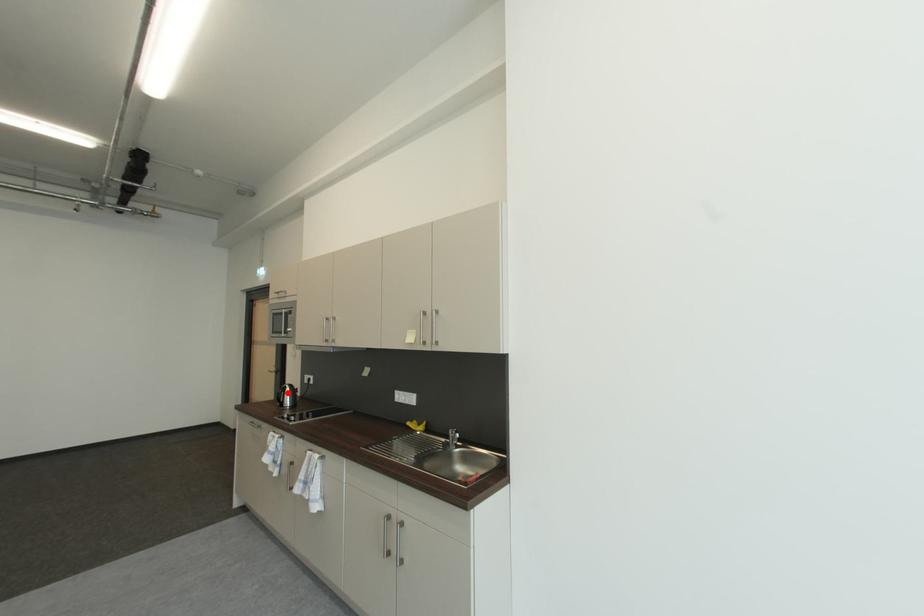
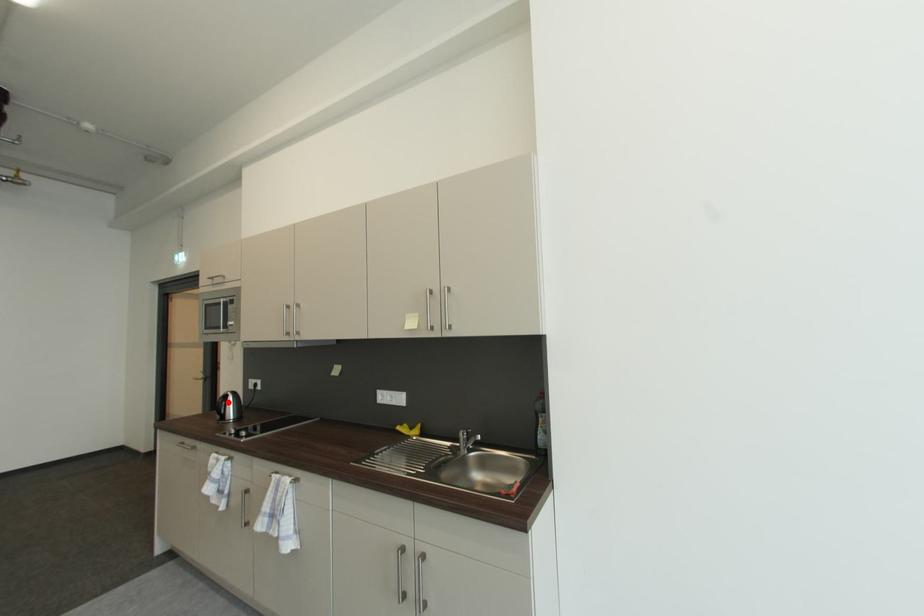
I am providing you with two images of the same scene from different viewpoints. A red point is marked on the first image and another point is marked on the second image. Are the points marked in image1 and image2 representing the same 3D position?

Yes